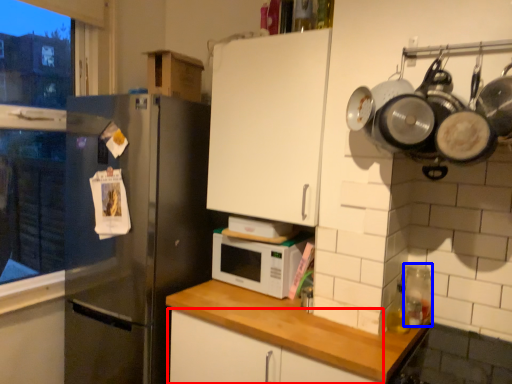
Question: Which of the following is the farthest to the observer, cabinetry (highlighted by a red box) or appliance (highlighted by a blue box)?

Choices:
 (A) cabinetry
 (B) appliance

Answer: (B)